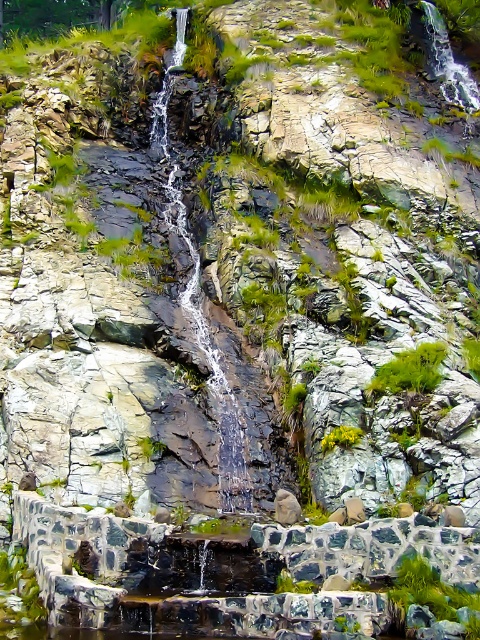
You are a hiker who wants to cross the stream at the base of the waterfall. You see the clear water at center and the green leafy plant at center. Which one is wider, and can you step on the plant to cross?

The clear water at center is wider than the green leafy plant at center. However, stepping on the plant may damage it, so it is better to find another safe path to cross the stream.